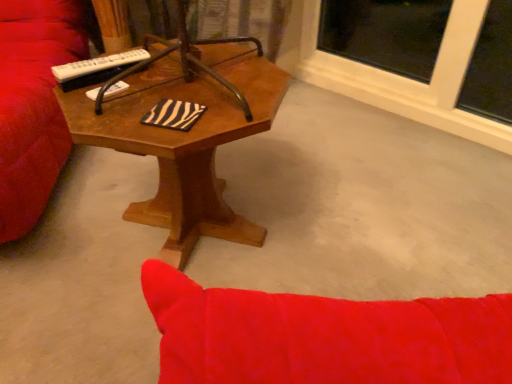
Identify the location of free spot behind wooden coffee table at center. This screenshot has height=384, width=512. (254, 148).